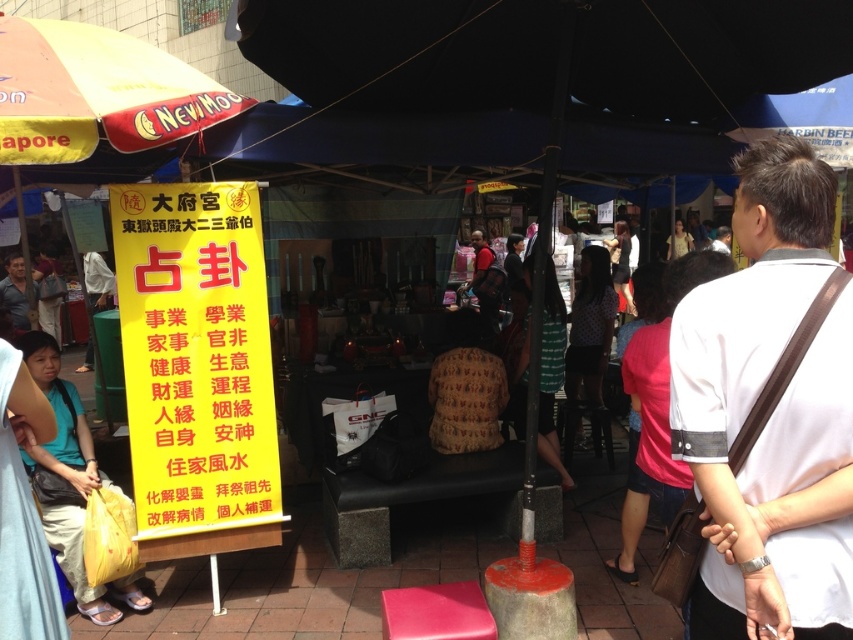
You are a customer at the market and need to decide whether to place a white fabric shirt at center into a yellow plastic bag at lower left. Based on their sizes, will the shirt fit inside the bag?

The white fabric shirt at center is not as tall as the yellow plastic bag at lower left, so the shirt should fit inside the bag since the bag is taller.